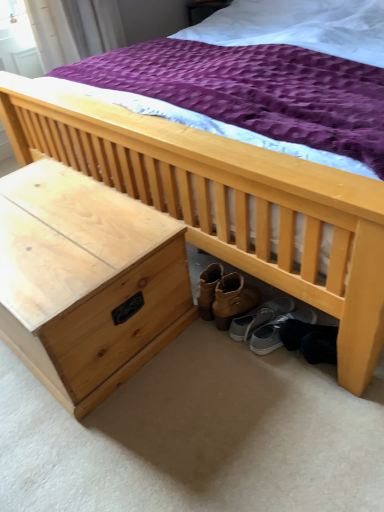
Question: Does gray fabric shoe at under bed, the second footwear when ordered from right to left, have a larger size compared to gray suede sneakers at lower right, the 1th footwear positioned from the right?

Choices:
 (A) yes
 (B) no

Answer: (B)

Question: Is gray fabric shoe at under bed, the first footwear viewed from the left, outside gray suede sneakers at lower right, the 1th footwear positioned from the right?

Choices:
 (A) yes
 (B) no

Answer: (A)

Question: Considering the relative positions of gray fabric shoe at under bed, the first footwear viewed from the left, and gray suede sneakers at lower right, acting as the 2th footwear starting from the left, in the image provided, is gray fabric shoe at under bed, the first footwear viewed from the left, in front of gray suede sneakers at lower right, acting as the 2th footwear starting from the left,?

Choices:
 (A) yes
 (B) no

Answer: (B)

Question: Could you tell me if gray fabric shoe at under bed, the first footwear viewed from the left, is facing gray suede sneakers at lower right, acting as the 2th footwear starting from the left?

Choices:
 (A) yes
 (B) no

Answer: (B)

Question: Are gray fabric shoe at under bed, the first footwear viewed from the left, and gray suede sneakers at lower right, the 1th footwear positioned from the right, far apart?

Choices:
 (A) no
 (B) yes

Answer: (A)

Question: Based on their positions, is natural wood nightstand at lower left located to the left or right of gray fabric shoe at under bed, the first footwear viewed from the left?

Choices:
 (A) right
 (B) left

Answer: (B)

Question: From a real-world perspective, is natural wood nightstand at lower left positioned above or below gray fabric shoe at under bed, the first footwear viewed from the left?

Choices:
 (A) above
 (B) below

Answer: (A)

Question: From the image's perspective, is natural wood nightstand at lower left above or below gray fabric shoe at under bed, the second footwear when ordered from right to left?

Choices:
 (A) above
 (B) below

Answer: (A)

Question: Considering the positions of point (59, 279) and point (235, 325), is point (59, 279) closer or farther from the camera than point (235, 325)?

Choices:
 (A) closer
 (B) farther

Answer: (A)

Question: Considering the positions of gray fabric shoe at under bed, the first footwear viewed from the left, and natural wood nightstand at lower left in the image, is gray fabric shoe at under bed, the first footwear viewed from the left, taller or shorter than natural wood nightstand at lower left?

Choices:
 (A) short
 (B) tall

Answer: (A)

Question: Is point (259, 315) positioned closer to the camera than point (112, 356)?

Choices:
 (A) closer
 (B) farther

Answer: (B)

Question: Is gray fabric shoe at under bed, the first footwear viewed from the left, in front of or behind natural wood nightstand at lower left in the image?

Choices:
 (A) behind
 (B) front

Answer: (A)

Question: From a real-world perspective, is gray fabric shoe at under bed, the first footwear viewed from the left, physically located above or below natural wood nightstand at lower left?

Choices:
 (A) below
 (B) above

Answer: (A)

Question: Would you say natural wood nightstand at lower left is inside or outside gray suede sneakers at lower right, acting as the 2th footwear starting from the left?

Choices:
 (A) inside
 (B) outside

Answer: (B)

Question: From a real-world perspective, is natural wood nightstand at lower left positioned above or below gray suede sneakers at lower right, the 1th footwear positioned from the right?

Choices:
 (A) below
 (B) above

Answer: (B)